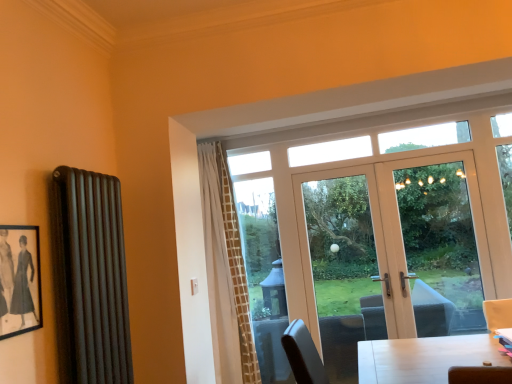
Locate an element on the screen. The height and width of the screenshot is (384, 512). blank space situated above transparent glass door at center, the second window screen positioned from the back (from a real-world perspective) is located at coordinates (419, 151).